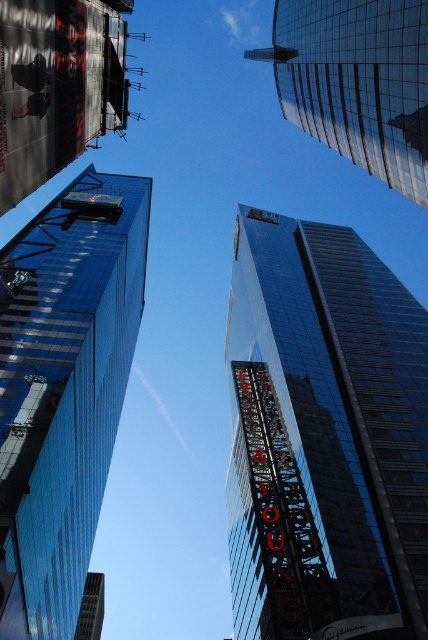
Question: Which of the following is the closest to the observer?

Choices:
 (A) shiny glass skyscraper at upper center
 (B) shiny glass skyscraper at left

Answer: (A)

Question: Which is nearer to the shiny glass skyscraper at upper center?

Choices:
 (A) shiny glass skyscraper at left
 (B) reflective glass billboard at upper left
 (C) black glass building at center

Answer: (B)

Question: Among these points, which one is nearest to the camera?

Choices:
 (A) (11, 192)
 (B) (250, 236)

Answer: (A)

Question: Is black glass building at center wider than shiny glass skyscraper at upper center?

Choices:
 (A) yes
 (B) no

Answer: (A)

Question: Can you confirm if shiny glass skyscraper at upper center is smaller than reflective glass billboard at upper left?

Choices:
 (A) yes
 (B) no

Answer: (B)

Question: Is black glass building at center positioned at the back of reflective glass billboard at upper left?

Choices:
 (A) yes
 (B) no

Answer: (A)